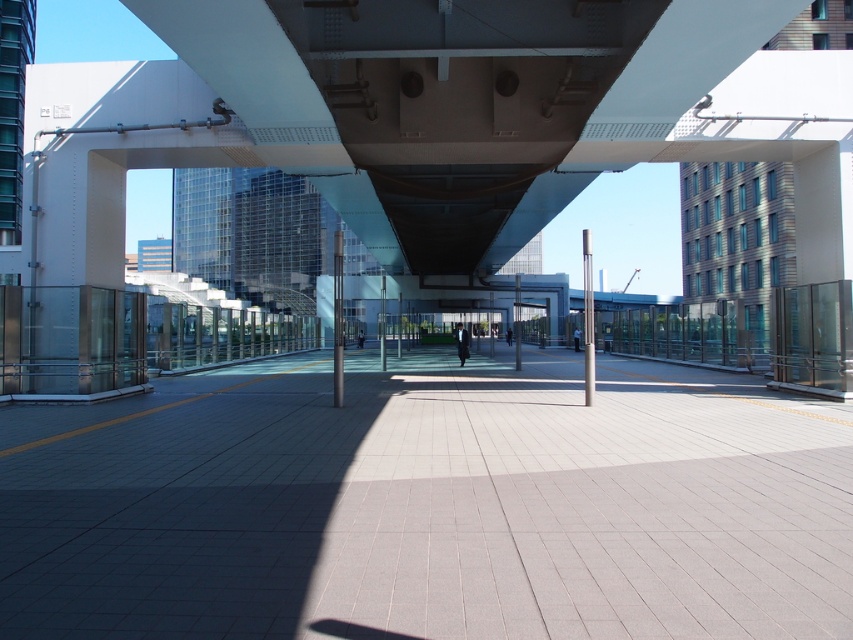
Who is more distant from viewer, (666,452) or (165,157)?

Point (165,157)

Who is more forward, (548,413) or (653,129)?

Point (548,413)

Where is `light gray concrete pavement at center`? This screenshot has width=853, height=640. light gray concrete pavement at center is located at coordinates (430, 504).